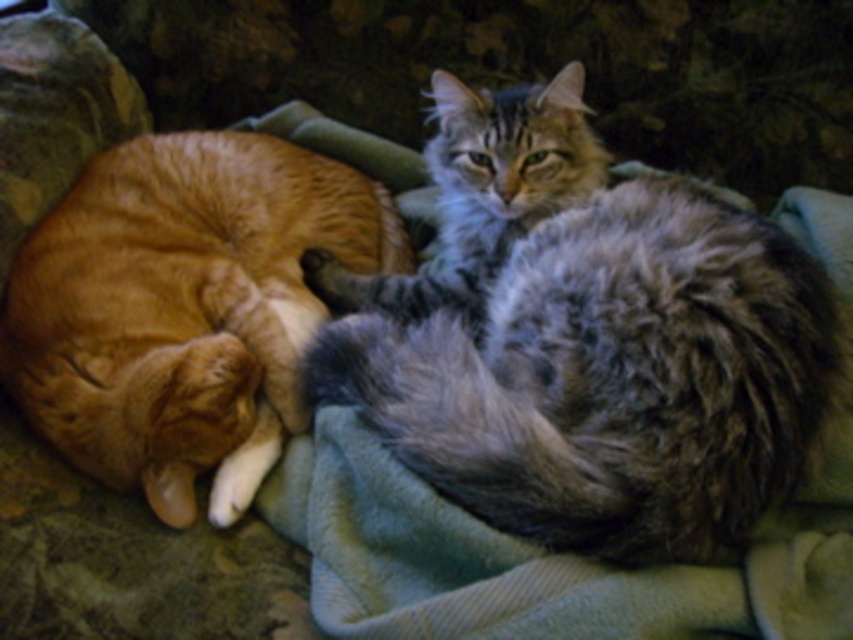
Is gray fluffy cat at center below orange fur cat at left?

Yes.

Which is above, gray fluffy cat at center or orange fur cat at left?

orange fur cat at left is above.

Where is `gray fluffy cat at center`? The image size is (853, 640). gray fluffy cat at center is located at coordinates (585, 340).